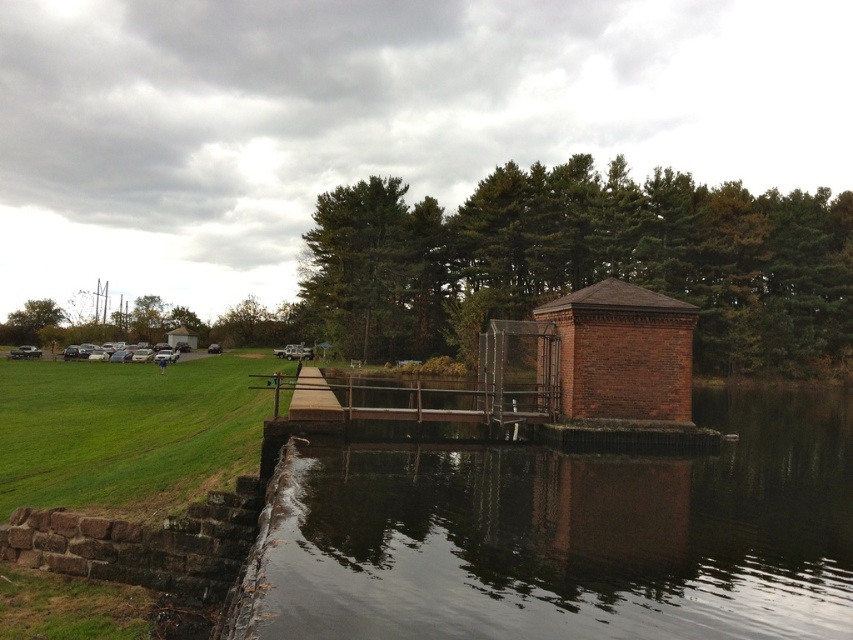
The image size is (853, 640). Describe the element at coordinates (573, 536) in the screenshot. I see `dark reflective water at center` at that location.

Does dark reflective water at center appear over brown wooden dock at center?

Actually, dark reflective water at center is below brown wooden dock at center.

Which is in front, point (511, 512) or point (442, 412)?

Point (511, 512) is in front.

Where is `dark reflective water at center`? Image resolution: width=853 pixels, height=640 pixels. dark reflective water at center is located at coordinates (573, 536).

Measure the distance from dark reflective water at center to brick gazebo at center.

The distance of dark reflective water at center from brick gazebo at center is 5.65 meters.

Does dark reflective water at center appear under brick gazebo at center?

Yes, dark reflective water at center is below brick gazebo at center.

Does point (317, 595) lie behind point (639, 324)?

No.

Locate an element on the screen. dark reflective water at center is located at coordinates (573, 536).

Can you confirm if brick gazebo at center is smaller than brown wooden dock at center?

Indeed, brick gazebo at center has a smaller size compared to brown wooden dock at center.

Between point (670, 396) and point (498, 404), which one is positioned behind?

The point (498, 404) is behind.

Which is in front, point (682, 342) or point (315, 412)?

Point (315, 412) is more forward.

Locate an element on the screen. This screenshot has width=853, height=640. brick gazebo at center is located at coordinates (622, 353).